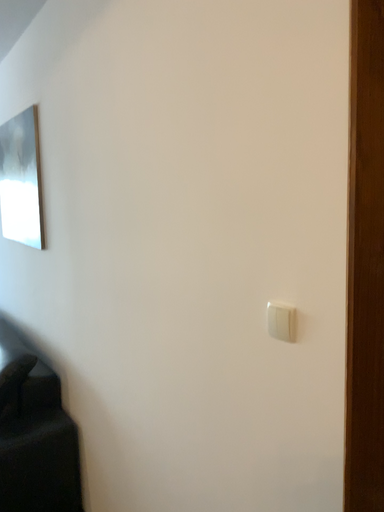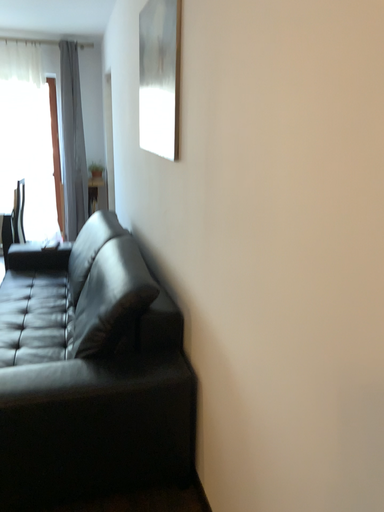
Question: How did the camera likely rotate when shooting the video?

Choices:
 (A) rotated upward
 (B) rotated downward

Answer: (B)